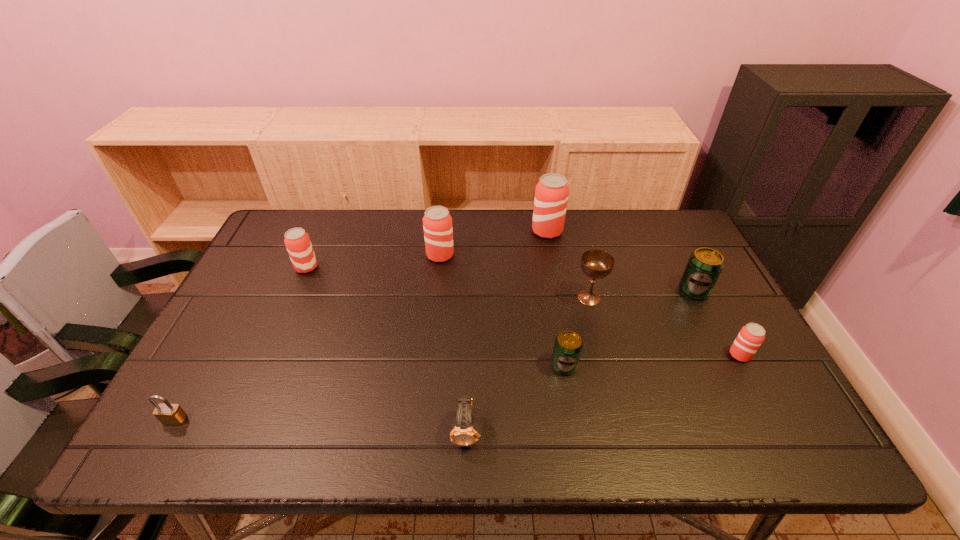
Find the location of a particular element. vacant space that's between the nearer green beer can and the tallest object is located at coordinates (556, 298).

At what (x,y) coordinates should I click in order to perform the action: click on vacant space in between the leftmost beer can and the second tallest beer can. Please return your answer as a coordinate pair (x, y). This screenshot has height=540, width=960. Looking at the image, I should click on (373, 261).

Identify the location of empty space between the padlock and the right green beer can. This screenshot has width=960, height=540. (435, 355).

Find the location of a particular element. object identified as the third closest to the second beer can from left to right is located at coordinates (597, 264).

Find the location of a particular element. This screenshot has width=960, height=540. object that is the second nearest to the third smallest orange beer can is located at coordinates (297, 241).

Find the location of a particular element. The width and height of the screenshot is (960, 540). the fourth closest beer can relative to the nearest orange beer can is located at coordinates (437, 222).

The height and width of the screenshot is (540, 960). Identify the location of beer can object that ranks as the fifth closest to the farthest orange beer can. (297, 241).

The image size is (960, 540). I want to click on the third closest orange beer can relative to the smallest orange beer can, so click(297, 241).

Where is `orange beer can identified as the third closest to the right green beer can`? The height and width of the screenshot is (540, 960). orange beer can identified as the third closest to the right green beer can is located at coordinates point(437,222).

Image resolution: width=960 pixels, height=540 pixels. Identify the location of vacant area that satisfies the following two spatial constraints: 1. on the back side of the leftmost object; 2. on the right side of the smaller green beer can. (205, 366).